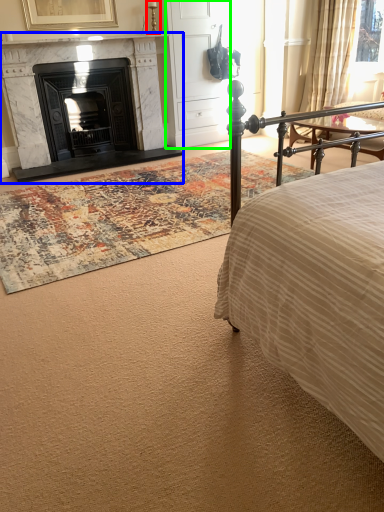
Question: Which object is positioned closest to table lamp (highlighted by a red box)? Select from fireplace (highlighted by a blue box) and armoire (highlighted by a green box).

Choices:
 (A) fireplace
 (B) armoire

Answer: (B)